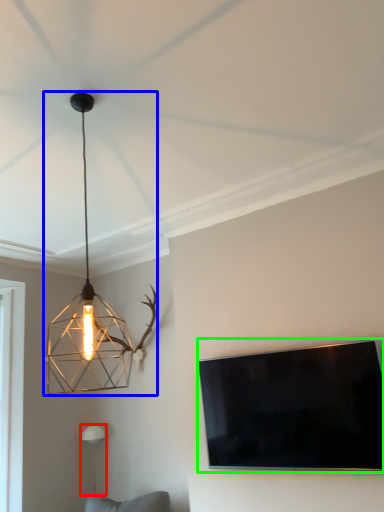
Question: Estimate the real-world distances between objects in this image. Which object is farther from lamp (highlighted by a red box), lamp (highlighted by a blue box) or television (highlighted by a green box)?

Choices:
 (A) lamp
 (B) television

Answer: (B)